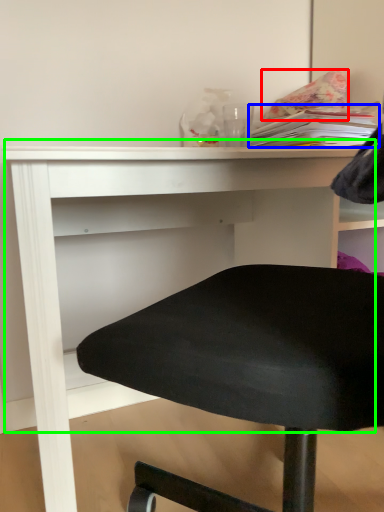
Question: Which object is the closest to the pillow (highlighted by a red box)? Choose among these: book (highlighted by a blue box) or table (highlighted by a green box).

Choices:
 (A) book
 (B) table

Answer: (A)